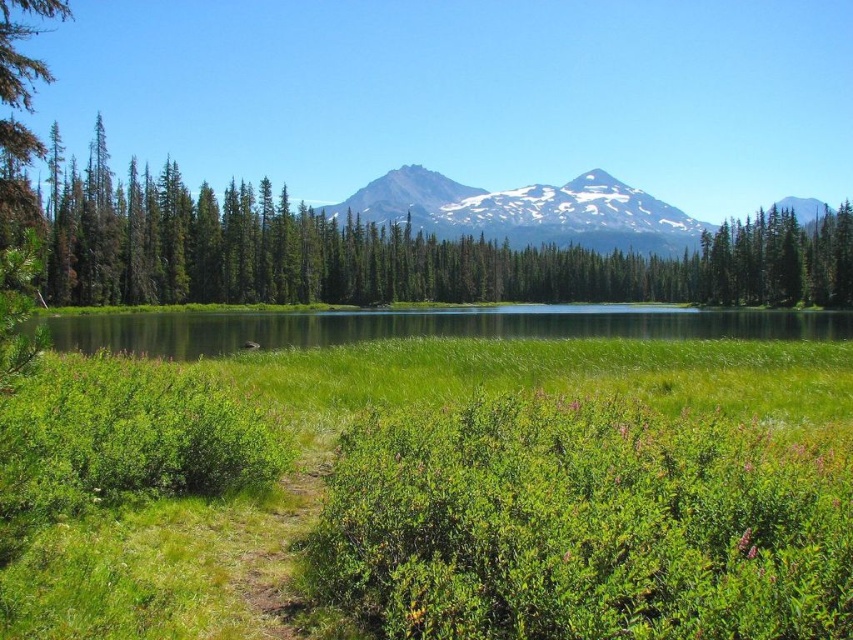
Looking at this image, you are standing at the viewpoint of the image and want to walk towards both the point at (410,492) and the point at (474,202). Which point will you reach first?

You will reach the point at (410,492) first because it is closer to you than the point at (474,202).

You are planning a hiking trip and see the green leafy trees at center and the snowy rock mountain at center in the distance. Which one is closer to your current position?

The green leafy trees at center are closer to your current position because they are located below the snowy rock mountain at center in the scene.

You are standing at the entrance of the dirt path and want to reach the green leafy trees at center. According to the coordinates provided, which direction should you head to from the dirt path?

The green leafy trees at center are located at coordinates point [380,252], so you should head towards the center of the image from the dirt path to reach them.